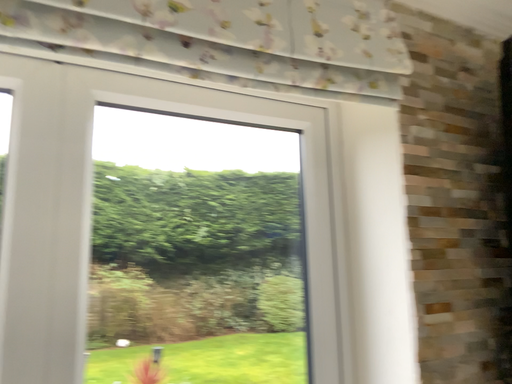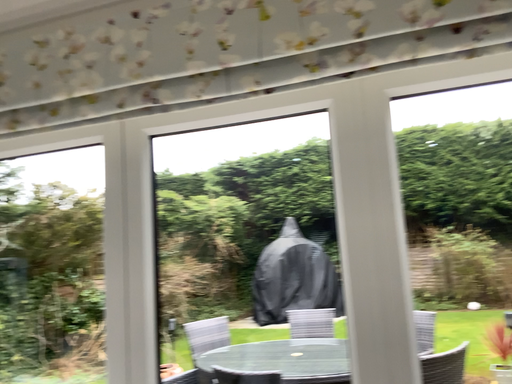
Question: Which way did the camera rotate in the video?

Choices:
 (A) rotated upward
 (B) rotated downward

Answer: (B)